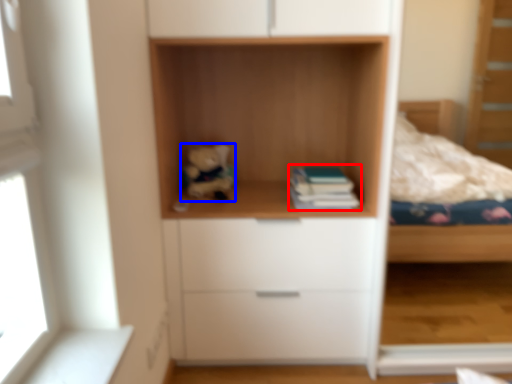
Question: Which of the following is the farthest to the observer, paperback book (highlighted by a red box) or toy (highlighted by a blue box)?

Choices:
 (A) paperback book
 (B) toy

Answer: (B)